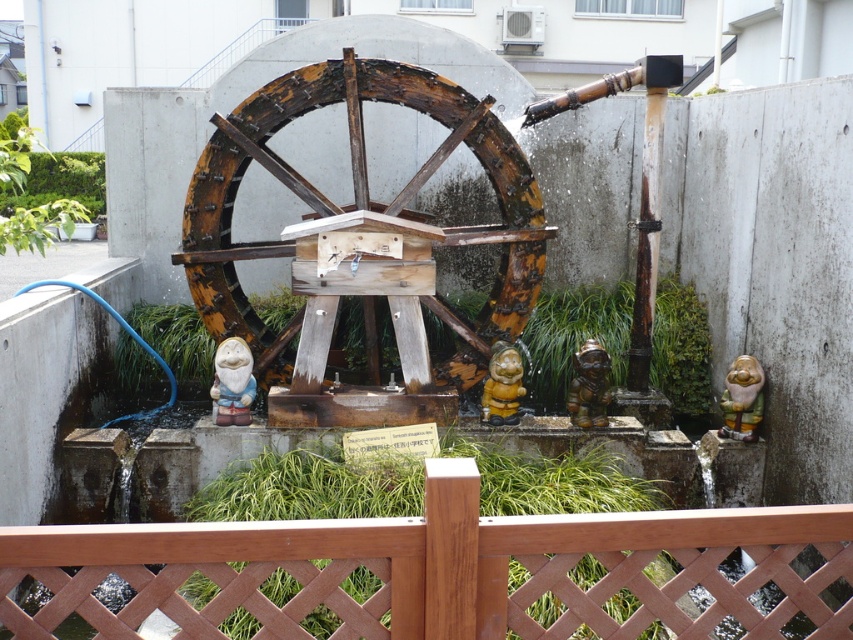
Question: Which of the following is the farthest from the observer?

Choices:
 (A) brown matte figurine at center
 (B) yellow matte figurine at center
 (C) rusty wood wagon wheel at center

Answer: (B)

Question: Which point appears closest to the camera in this image?

Choices:
 (A) (241, 392)
 (B) (643, 557)
 (C) (598, 392)
 (D) (753, 412)

Answer: (B)

Question: Observing the image, what is the correct spatial positioning of green glazed ceramic gnome at center in reference to brown matte figurine at center?

Choices:
 (A) left
 (B) right

Answer: (B)

Question: Estimate the real-world distances between objects in this image. Which object is farther from the yellow matte figurine at center?

Choices:
 (A) green glazed ceramic gnome at center
 (B) brown wooden fence at center

Answer: (B)

Question: Is white glossy gnome at center closer to the viewer compared to green glazed ceramic gnome at center?

Choices:
 (A) no
 (B) yes

Answer: (B)

Question: Is brown wooden fence at center in front of yellow matte figurine at center?

Choices:
 (A) yes
 (B) no

Answer: (A)